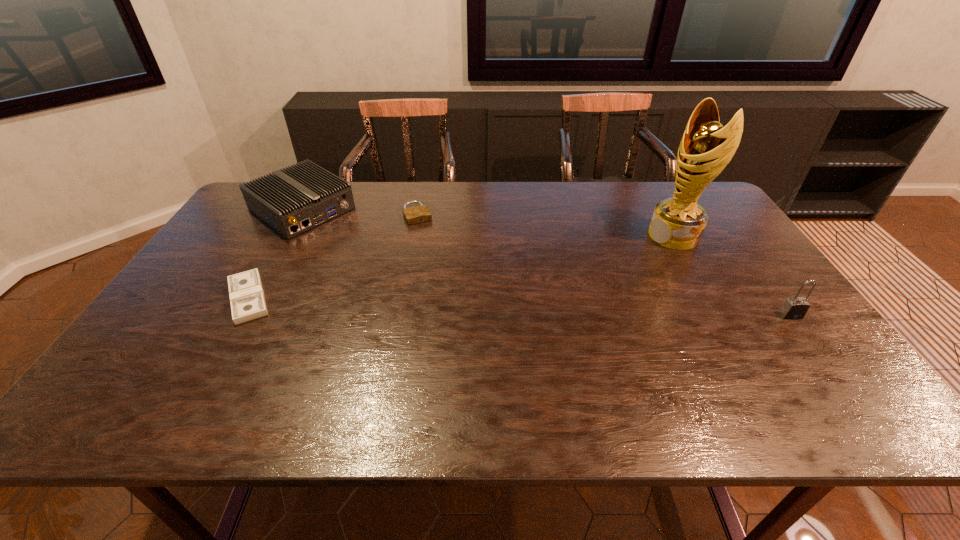
This screenshot has height=540, width=960. In order to click on vacant space located on the back panel of the third shortest object in this screenshot , I will do `click(405, 280)`.

In order to click on free space located on the back panel of the third shortest object in this screenshot , I will do `click(341, 236)`.

Where is `free spot located on the back panel of the third shortest object`? free spot located on the back panel of the third shortest object is located at coordinates (348, 241).

Locate an element on the screen. The width and height of the screenshot is (960, 540). free location located on the front-facing side of the second object from right to left is located at coordinates (577, 272).

You are a GUI agent. You are given a task and a screenshot of the screen. Output one action in this format:
    pyautogui.click(x=<x>, y=<y>)
    Task: Click on the vacant region located 0.310m on the front-facing side of the second object from right to left
    
    Given the screenshot: What is the action you would take?
    pyautogui.click(x=574, y=273)

Find the location of a particular element. Image resolution: width=960 pixels, height=540 pixels. vacant space situated 0.140m on the front-facing side of the second object from right to left is located at coordinates (620, 255).

Locate an element on the screen. This screenshot has height=540, width=960. free spot located 0.270m on the keyhole side of the shorter padlock is located at coordinates (445, 275).

Find the location of `free point located 0.290m on the keyhole side of the shorter padlock`. free point located 0.290m on the keyhole side of the shorter padlock is located at coordinates (448, 280).

Locate an element on the screen. vacant space located on the keyhole side of the shorter padlock is located at coordinates (461, 306).

Find the location of a particular element. This screenshot has width=960, height=540. router present at the far edge is located at coordinates (294, 200).